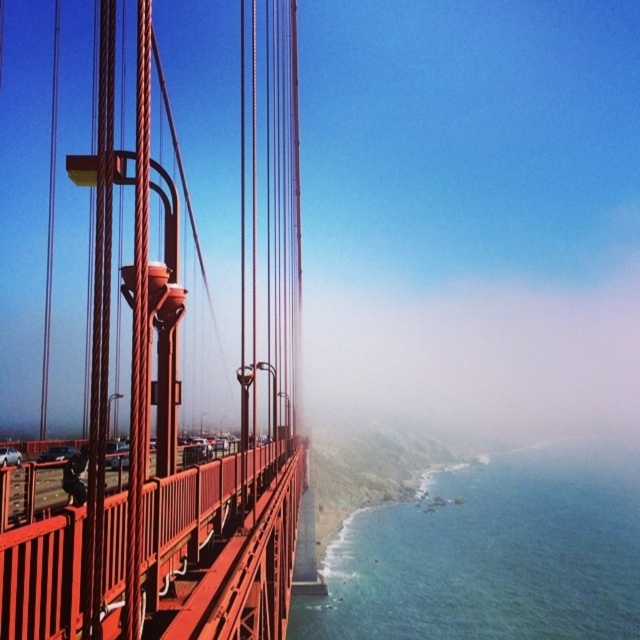
You are a photographer planning to capture the Golden Gate Bridge from a drone. Your drone has a camera that can focus on objects up to 100 meters tall. Based on the scene, will the smooth metal suspension bridge at left and the blue water at lower right both be within the camera focus range?

The smooth metal suspension bridge at left is taller than blue water at lower right. Since the bridge is taller than the water, and the camera can focus up to 100 meters, both objects will be within the focus range as long as their heights are under 100 meters. However, the exact heights aren

You are a photographer standing at the Golden Gate Bridge. You want to capture a photo that includes the smooth metal suspension bridge at left and the rugged cliffs on the right. Based on their positions, which object should you focus on first to ensure both are in frame?

The smooth metal suspension bridge at left is located at point (177, 397), so you should focus on the smooth metal suspension bridge at left first to ensure both it and the rugged cliffs on the right are in frame.

You are a photographer standing on the Golden Gate Bridge. You want to take a picture of the blue water at lower right without the smooth metal suspension bridge at left blocking the view. Is it possible to do so from your current position?

The smooth metal suspension bridge at left is in front of the blue water at lower right, so you cannot take a picture of the blue water at lower right without the bridge blocking the view from your current position.